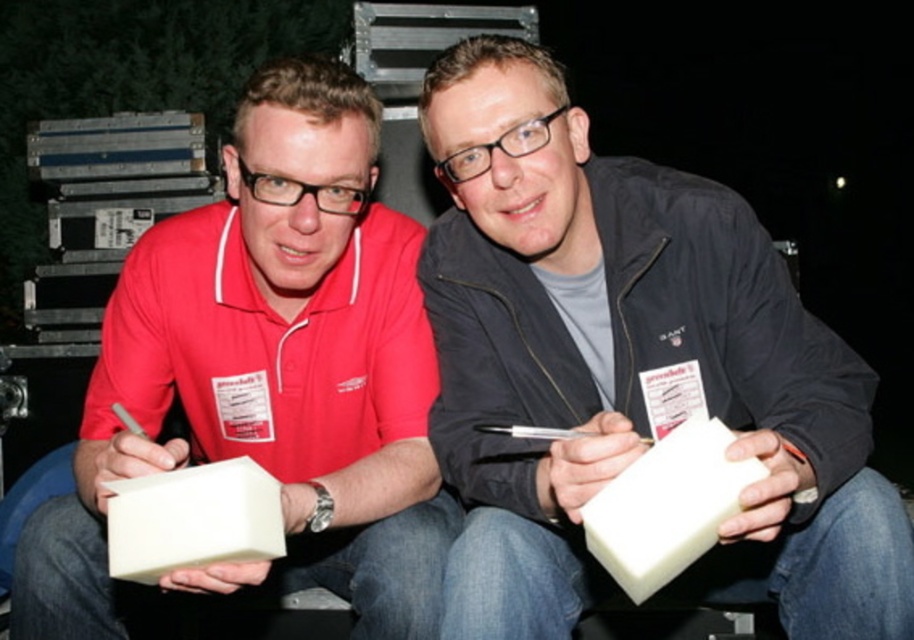
Question: Is matte black jacket at center to the left of matte red shirt at center from the viewer's perspective?

Choices:
 (A) yes
 (B) no

Answer: (B)

Question: Does matte black jacket at center have a greater width compared to matte red shirt at center?

Choices:
 (A) yes
 (B) no

Answer: (B)

Question: Is the position of matte black jacket at center less distant than that of matte red shirt at center?

Choices:
 (A) no
 (B) yes

Answer: (B)

Question: Which object appears farthest from the camera in this image?

Choices:
 (A) matte black jacket at center
 (B) matte red shirt at center

Answer: (B)